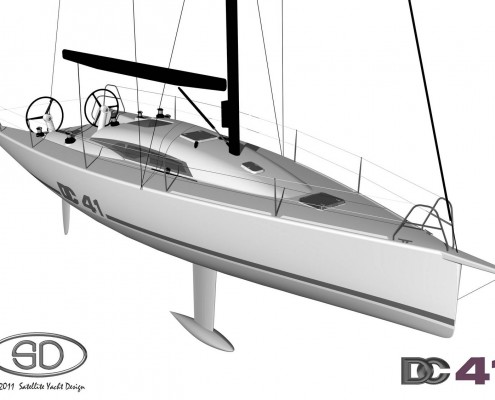
Where is `the right window`? The image size is (495, 400). the right window is located at coordinates (131, 146).